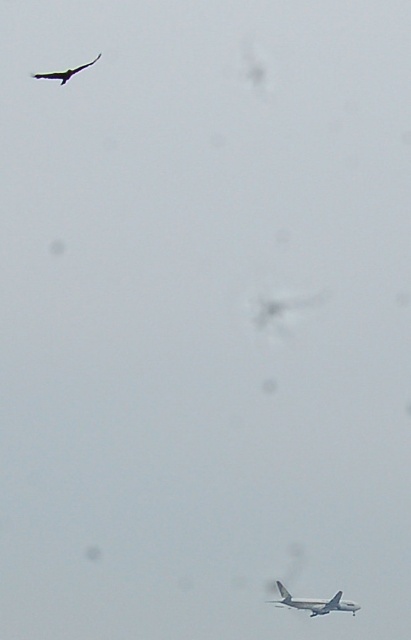
You are an observer looking at the sky scene. You notice two points marked in the image. Which point, point (309, 600) or point (69, 76), appears closer to you?

Point (309, 600) is closer to the viewer than point (69, 76) according to the description.

Looking at this image, you are an observer looking at the sky scene. You notice the silver metallic airplane at lower center and the dark gray feathers at upper left. Which object is located higher in the sky?

The dark gray feathers at upper left are higher in the sky than the silver metallic airplane at lower center because the airplane is positioned under them.

You are a pilot flying a small plane and need to avoid the silver metallic airplane at lower center. The safe distance required is 100 meters. Can you safely maneuver around it based on the distance provided?

The distance between the silver metallic airplane at lower center and the camera is 102.09 meters, which exceeds the required safe distance of 100 meters. Therefore, you can safely maneuver around the silver metallic airplane at lower center.